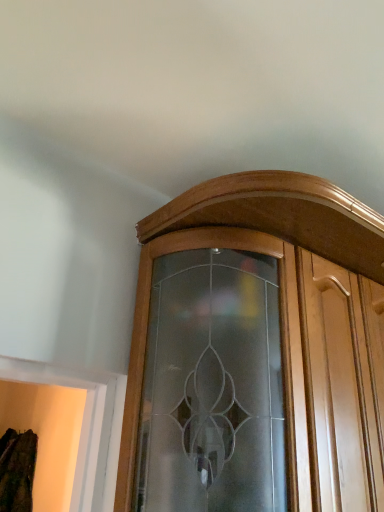
This screenshot has height=512, width=384. What do you see at coordinates (257, 352) in the screenshot? I see `wooden cabinet at center` at bounding box center [257, 352].

Image resolution: width=384 pixels, height=512 pixels. I want to click on wooden cabinet at center, so pyautogui.click(x=257, y=352).

Where is `wooden cabinet at center`? Image resolution: width=384 pixels, height=512 pixels. wooden cabinet at center is located at coordinates (257, 352).